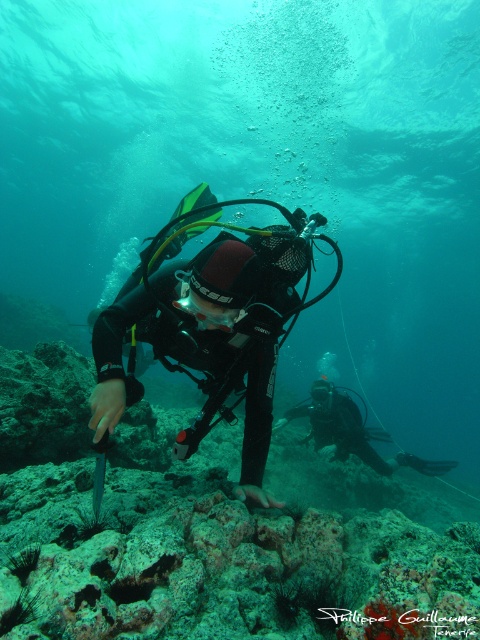
You are a marine biologist planning to dive to the rough textured coral reef at center. Based on the coordinates given, can you determine if the reef is located in the lower half of the image?

The rough textured coral reef at center is located at coordinates point (204, 532). Since the y coordinate is 0.425, which is less than 0.5, the reef is in the lower half of the image.

You are a marine biologist planning to place a research buoy at point [204,532] in the underwater scene. Based on the image, what object will the buoy be placed on?

The buoy will be placed on the rough textured coral reef at center, as point [204,532] corresponds to that object.

You are a scuba diver preparing to swim towards a specific point underwater. You see the point marked at coordinates point (34, 518). Given that you are currently 7.15 feet away from this point, can you safely reach it without exceeding your air supply if your tank has enough air for 10 minutes of diving and you swim at a moderate pace?

Yes, you can safely reach the point marked at coordinates point (34, 518) because you are only 7.15 feet away, which is a short distance that can be covered within the 10 minutes of air supply available.